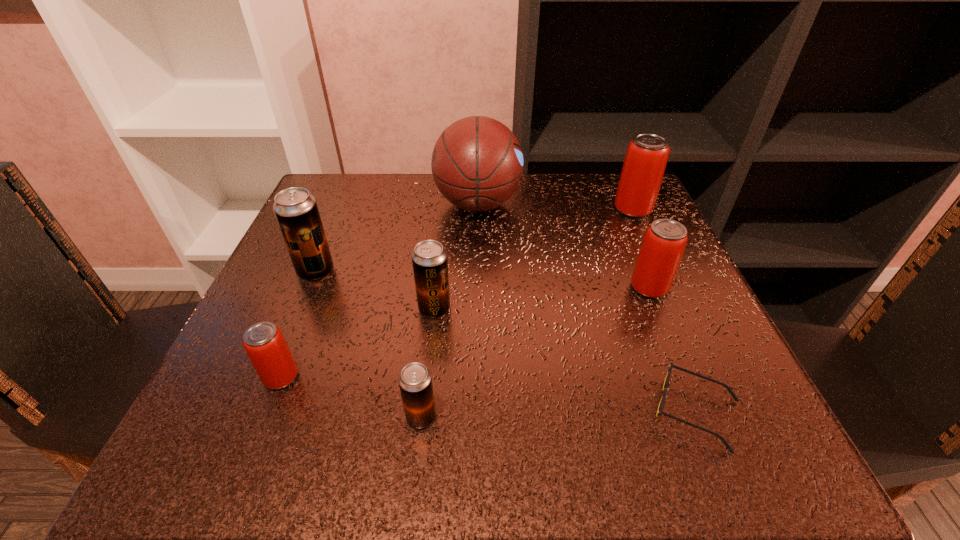
Where is `vacant region at the far edge of the desktop`? The width and height of the screenshot is (960, 540). vacant region at the far edge of the desktop is located at coordinates (560, 183).

What are the coordinates of `free space at the near edge of the desktop` in the screenshot? It's located at (483, 412).

Find the location of a particular element. free location at the left edge of the desktop is located at coordinates (330, 284).

The width and height of the screenshot is (960, 540). I want to click on free space at the right edge, so click(655, 345).

Find the location of a particular element. Image resolution: width=960 pixels, height=540 pixels. vacant region at the far left corner of the desktop is located at coordinates (349, 224).

You are a GUI agent. You are given a task and a screenshot of the screen. Output one action in this format:
    pyautogui.click(x=<x>, y=<y>)
    Task: Click on the vacant space at the far right corner of the desktop
    
    Given the screenshot: What is the action you would take?
    pyautogui.click(x=605, y=224)

In order to click on vacant space that is in between the basketball and the smallest black beer can in this screenshot , I will do `click(449, 310)`.

Locate an element on the screen. The height and width of the screenshot is (540, 960). free space that is in between the black sunglasses and the farthest pink beer can is located at coordinates (664, 310).

The width and height of the screenshot is (960, 540). I want to click on vacant area that lies between the shortest object and the leftmost black beer can, so click(x=506, y=341).

Where is `free space between the nearest black beer can and the farthest pink beer can`? free space between the nearest black beer can and the farthest pink beer can is located at coordinates (527, 313).